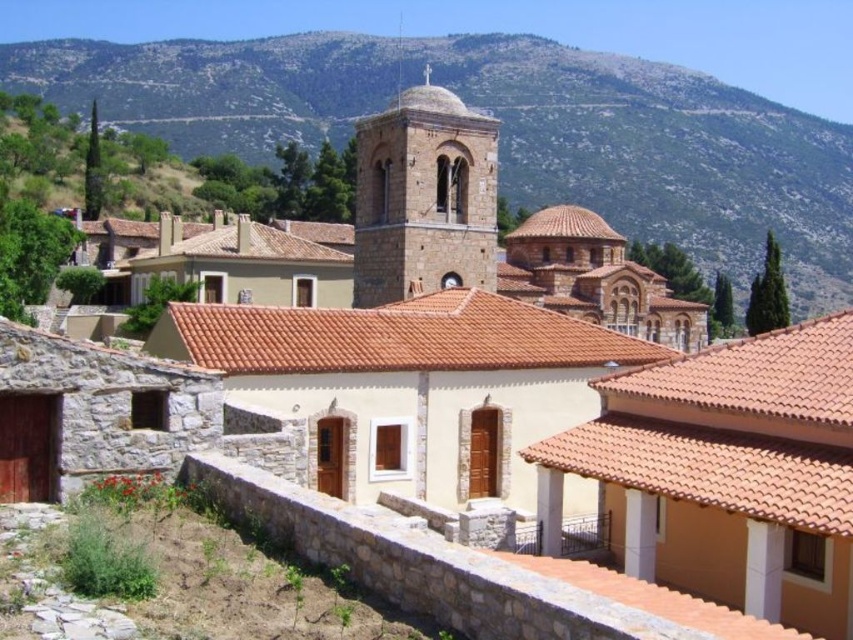
Question: Can you confirm if green rocky mountain at upper center is smaller than brown stone tower at center?

Choices:
 (A) yes
 (B) no

Answer: (B)

Question: Considering the real-world distances, which object is closest to the green rocky mountain at upper center?

Choices:
 (A) terracotta tile roof at center
 (B) brown stone tower at center

Answer: (B)

Question: Which of these objects is positioned closest to the green rocky mountain at upper center?

Choices:
 (A) brown stone tower at center
 (B) terracotta tile roof at center

Answer: (A)

Question: Estimate the real-world distances between objects in this image. Which object is closer to the terracotta tile roof at center?

Choices:
 (A) brown stone tower at center
 (B) green rocky mountain at upper center

Answer: (A)

Question: Can you confirm if green rocky mountain at upper center is positioned below brown stone tower at center?

Choices:
 (A) yes
 (B) no

Answer: (B)

Question: Can you confirm if green rocky mountain at upper center is positioned above terracotta tile roof at center?

Choices:
 (A) no
 (B) yes

Answer: (B)